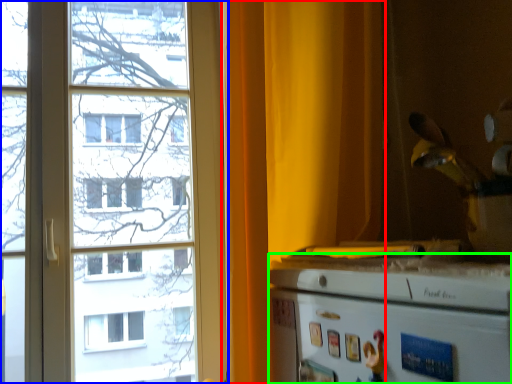
Question: Which is nearer to the curtain (highlighted by a red box)? window (highlighted by a blue box) or appliance (highlighted by a green box).

Choices:
 (A) window
 (B) appliance

Answer: (B)